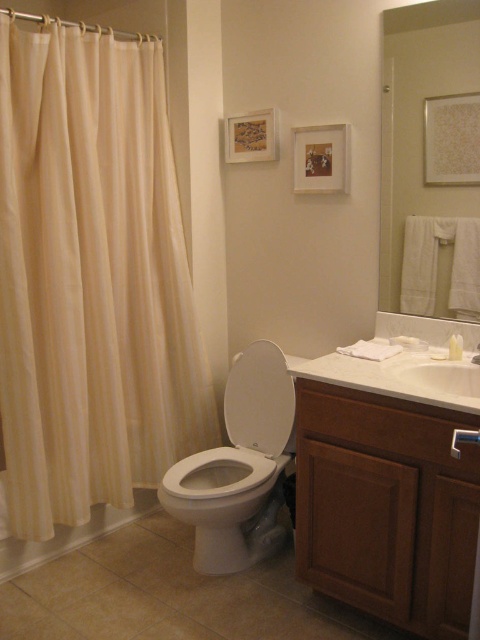
You are standing in the bathroom and want to know which of the two points, point (x=456, y=524) or point (x=105, y=513), is closer to you. Based on the bathroom layout described, can you determine which point is nearer?

Point (x=456, y=524) is closer to the camera than point (x=105, y=513). Therefore, point (x=456, y=524) is nearer to you.

You are a delivery person who just arrived at the bathroom to deliver a package. The package is 1.5 meters long. You need to place it horizontally between the brown wood vanity at lower right and the camera. Is there enough space for the package to fit without bending it?

The distance between the brown wood vanity at lower right and the camera is 1.61 meters. Since the package is 1.5 meters long, it will fit horizontally between them with some space to spare.